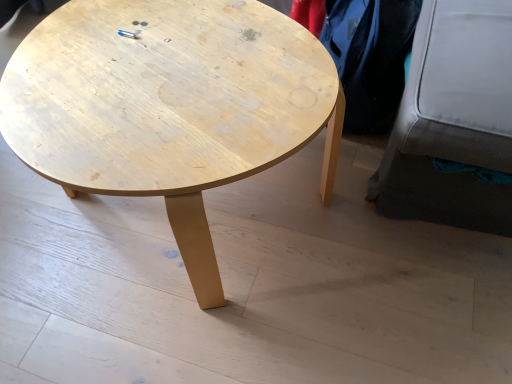
Where is `natural wood coffee table at center`? The image size is (512, 384). natural wood coffee table at center is located at coordinates (169, 106).

Describe the element at coordinates (169, 106) in the screenshot. I see `natural wood coffee table at center` at that location.

Measure the distance between point (x=126, y=182) and camera.

Point (x=126, y=182) is 28.15 inches from camera.

Image resolution: width=512 pixels, height=384 pixels. In order to click on natural wood coffee table at center in this screenshot , I will do 169,106.